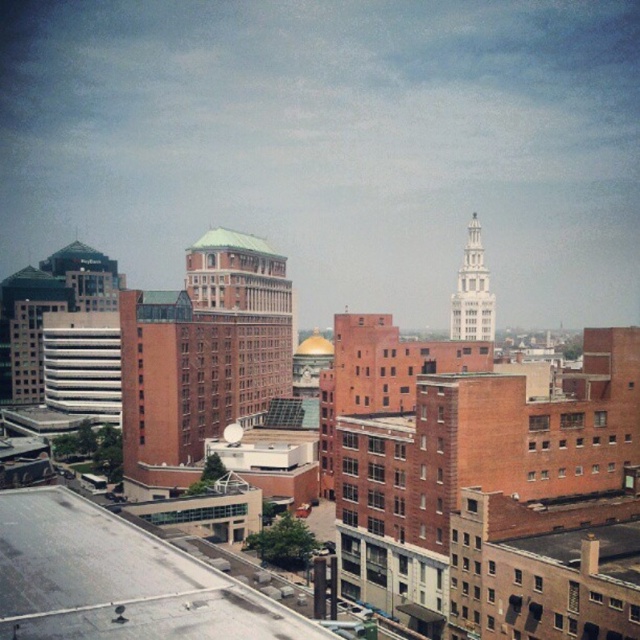
You are an urban planner analyzing the city layout. You need to determine the relative positions of the white stone tower at upper right and the green metallic roof at center for zoning purposes. Based on the scene, which object is positioned to the right of the other?

The white stone tower at upper right is positioned to the right of the green metallic roof at center.

In the scene shown: You are an architect analyzing the urban skyline. You need to determine the exact position of the white stone tower at upper right in the image. What are its coordinates?

The white stone tower at upper right is located at coordinates point (472, 292).

You are standing at the base of the white stone tower at upper right and want to walk to a nearby park entrance located 1000 feet away from the tower. Can you estimate whether the park entrance is within walking distance based on the tower distance?

The white stone tower at upper right is 844.96 feet away from the viewer. Since the park entrance is 1000 feet away from the tower, the total distance from the viewer to the park entrance would be approximately 1844.96 feet. This distance is quite far for a short walk, so the park entrance is likely not within a close walking distance.